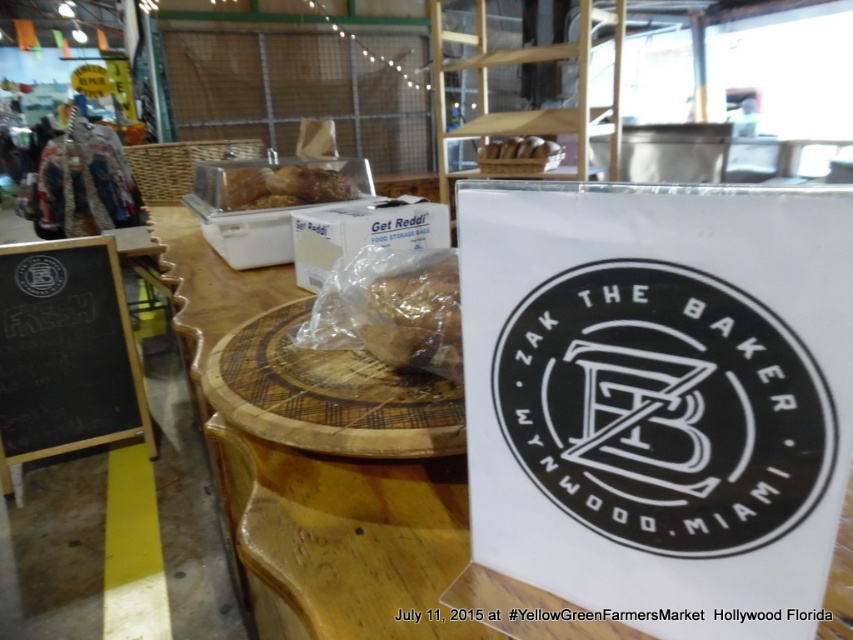
You are at the YellowGreenFarmersMarket in Hollywood, Florida. You see a wooden table with a loaf of bread wrapped in clear plastic and a white box labeled Get Reddi. There is also a larger container holding more loaves of bread. Where is the point located at coordinates (65, 353)?

The point at (65, 353) is on the black chalkboard at left.

You are a customer at the YellowGreenFarmersMarket in Hollywood, Florida. You see the black chalkboard at left and the translucent plastic bread at center. If you want to reach the bread first, which object should you approach first?

The translucent plastic bread at center is closer to you than the black chalkboard at left, so you should approach the translucent plastic bread at center first.

You are a customer at the YellowGreenFarmersMarket in Hollywood, Florida, looking at the bakery display. You see a brown crumbly bread at center and a translucent plastic bread at center. Which of these two items takes up more space on the table?

The translucent plastic bread at center occupies more space than the brown crumbly bread at center.